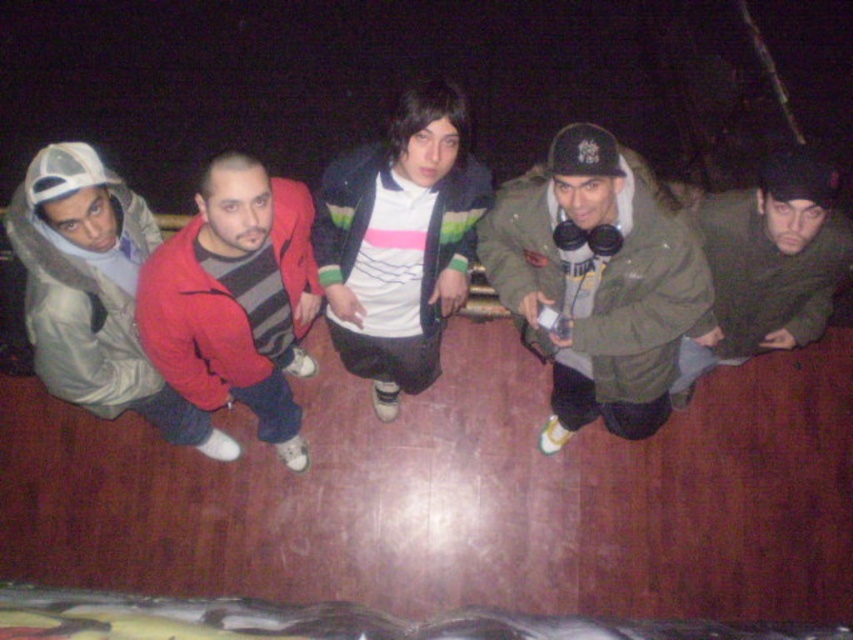
Does green matte jacket at center have a greater height compared to white striped shirt at center?

No.

Image resolution: width=853 pixels, height=640 pixels. Find the location of `green matte jacket at center`. green matte jacket at center is located at coordinates (596, 282).

Is white striped shirt at center above light gray hooded sweatshirt at left?

Yes.

Is point (409, 310) less distant than point (49, 292)?

No, it is behind (49, 292).

The height and width of the screenshot is (640, 853). What do you see at coordinates (399, 243) in the screenshot? I see `white striped shirt at center` at bounding box center [399, 243].

The width and height of the screenshot is (853, 640). I want to click on white striped shirt at center, so click(399, 243).

Does white striped shirt at center appear on the right side of red matte sweater at center?

Correct, you'll find white striped shirt at center to the right of red matte sweater at center.

Between point (357, 262) and point (299, 260), which one is positioned in front?

Point (299, 260) is in front.

At what (x,y) coordinates should I click in order to perform the action: click on white striped shirt at center. Please return your answer as a coordinate pair (x, y). The image size is (853, 640). Looking at the image, I should click on (399, 243).

The height and width of the screenshot is (640, 853). Find the location of `white striped shirt at center`. white striped shirt at center is located at coordinates (399, 243).